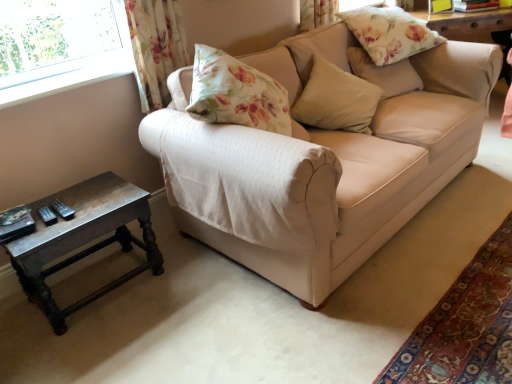
Question: Considering the positions of beige fabric couch at center and floral fabric pillow at upper right, the first pillow in the top-to-bottom sequence, in the image, is beige fabric couch at center taller or shorter than floral fabric pillow at upper right, the first pillow in the top-to-bottom sequence,?

Choices:
 (A) tall
 (B) short

Answer: (A)

Question: Considering the positions of beige fabric couch at center and floral fabric pillow at upper right, which is the third pillow from bottom to top, in the image, is beige fabric couch at center wider or thinner than floral fabric pillow at upper right, which is the third pillow from bottom to top,?

Choices:
 (A) thin
 (B) wide

Answer: (B)

Question: Based on their relative distances, which object is nearer to the floral fabric pillow at upper right, which is the third pillow from bottom to top?

Choices:
 (A) dark brown wooden table at lower left
 (B) floral fabric pillow at upper right, placed as the second pillow when sorted from bottom to top
 (C) beige fabric pillow at center, which is the third pillow from top to bottom
 (D) beige fabric couch at center
 (E) floral fabric curtain at upper left

Answer: (B)

Question: Which object is positioned closest to the floral fabric pillow at upper right, placed as the second pillow when sorted from bottom to top?

Choices:
 (A) floral fabric curtain at upper left
 (B) dark brown wooden table at lower left
 (C) beige fabric couch at center
 (D) beige fabric pillow at center, the 1th pillow in the bottom-to-top sequence
 (E) floral fabric pillow at upper right, the first pillow in the top-to-bottom sequence

Answer: (E)